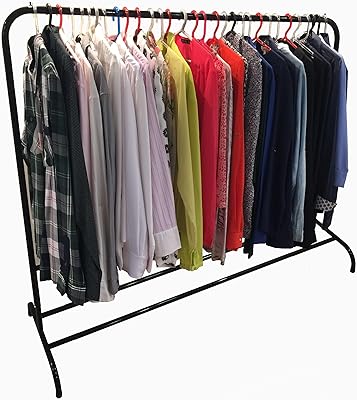
Where is `red hangers`? The width and height of the screenshot is (357, 400). red hangers is located at coordinates (60, 10), (128, 13), (138, 12), (170, 17), (197, 16), (204, 18), (216, 17), (261, 19), (290, 19).